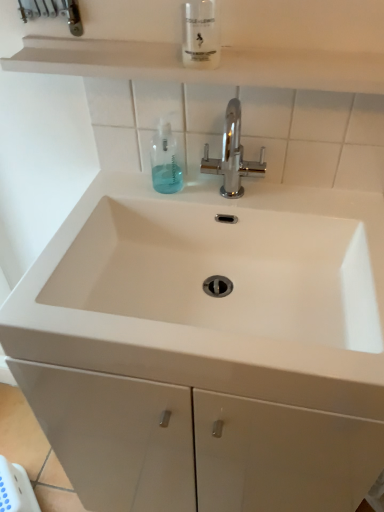
Locate an element on the screen. This screenshot has height=512, width=384. vacant area located to the right-hand side of chrome metallic faucet at center is located at coordinates (310, 198).